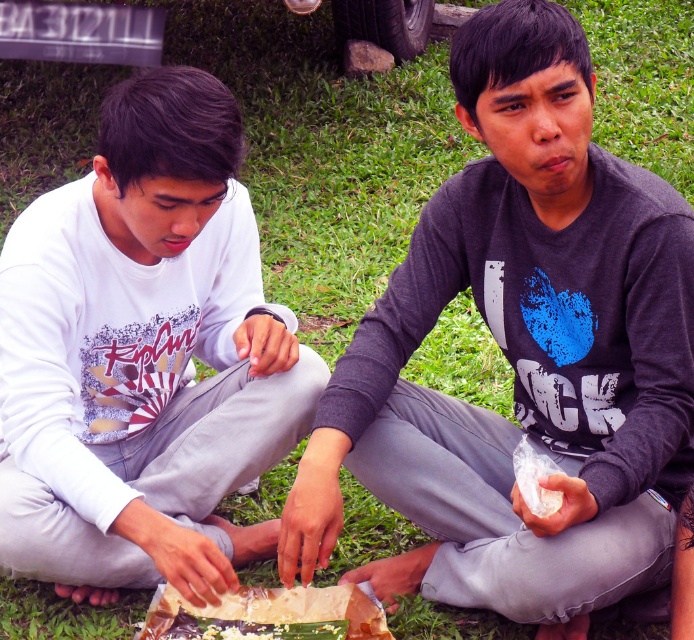
You are a photographer standing behind the two people in the image. You want to take a photo of the gray matte shirt at center and the white matte shirt at center. Which shirt will appear larger in the photo?

The gray matte shirt at center will appear larger in the photo because it is closer to the viewer than the white matte shirt at center.

You are a photographer trying to capture the scene of two people preparing food outdoors. You notice the gray matte shirt at center and the translucent plastic wrap at center. Which object should you focus on if you want to capture the larger item in your shot?

The gray matte shirt at center is bigger than the translucent plastic wrap at center, so you should focus on the gray matte shirt at center to capture the larger item.